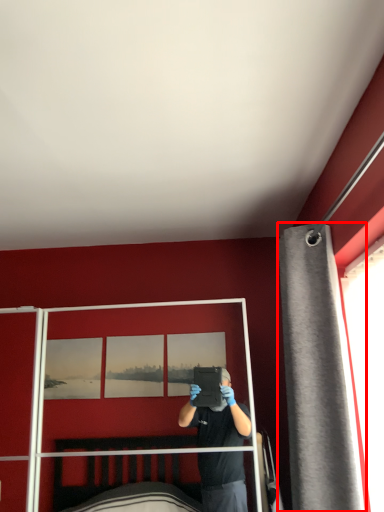
Question: In this image, where is curtain (annotated by the red box) located relative to screen door?

Choices:
 (A) left
 (B) right

Answer: (B)